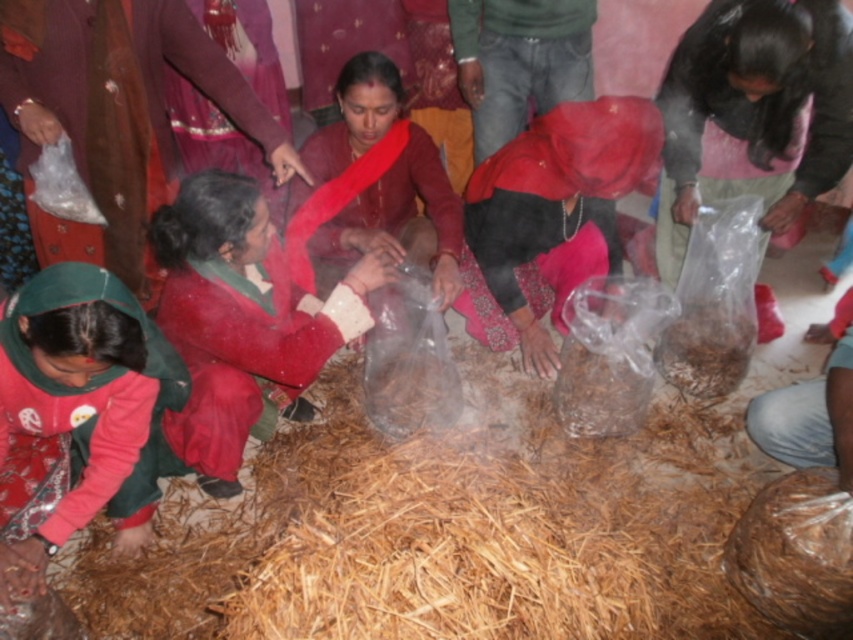
Question: Does matte red saree at lower left appear under green fabric cap at lower left?

Choices:
 (A) no
 (B) yes

Answer: (A)

Question: Does matte red saree at lower left appear on the right side of green fabric cap at lower left?

Choices:
 (A) no
 (B) yes

Answer: (A)

Question: Which point is closer to the camera?

Choices:
 (A) (102, 131)
 (B) (42, 378)

Answer: (B)

Question: From the image, what is the correct spatial relationship of matte red saree at lower left in relation to green fabric cap at lower left?

Choices:
 (A) above
 (B) below

Answer: (A)